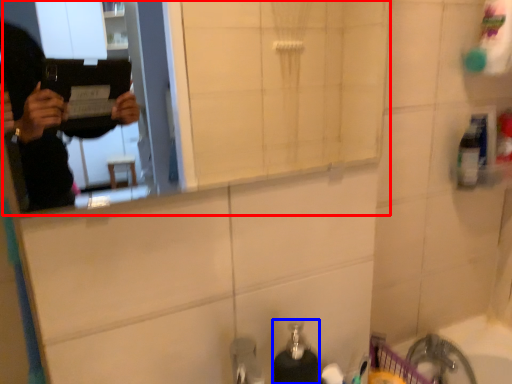
Question: Which of the following is the farthest to the observer, mirror (highlighted by a red box) or soap dispenser (highlighted by a blue box)?

Choices:
 (A) mirror
 (B) soap dispenser

Answer: (B)